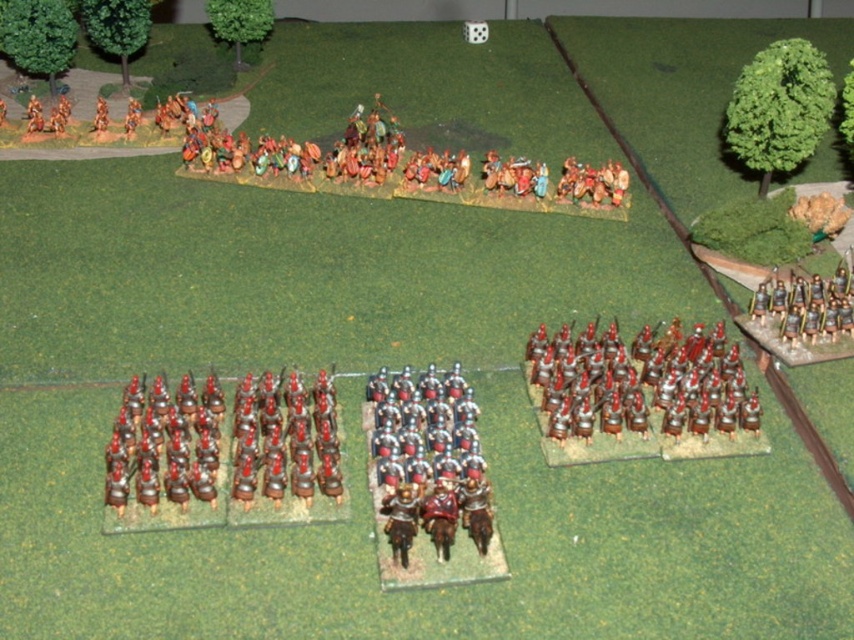
From the picture: You are a miniature figure standing on the battlefield. You want to throw a small stone to the metallic silver soldiers at center. Can you reach them with your throw if your maximum throwing distance is 4 feet?

The metallic silver soldiers at center are 4.67 feet away from you, which is beyond your maximum throwing distance of 4 feet. You cannot reach them with your throw.

You are a game master setting up a wargame table. You have a shiny silver armor at center and metallic silver soldiers at center. Which object should you move if you need to create more space for a new unit between them?

The shiny silver armor at center is bigger than metallic silver soldiers at center, so you should move the shiny silver armor at center to create more space.

You are a miniature figure in the foreground of the battle scene. You want to move towards the camera. Which point should you move towards, point (428, 524) or point (261, 412)?

You should move towards point (428, 524) because it is closer to the camera than point (261, 412).